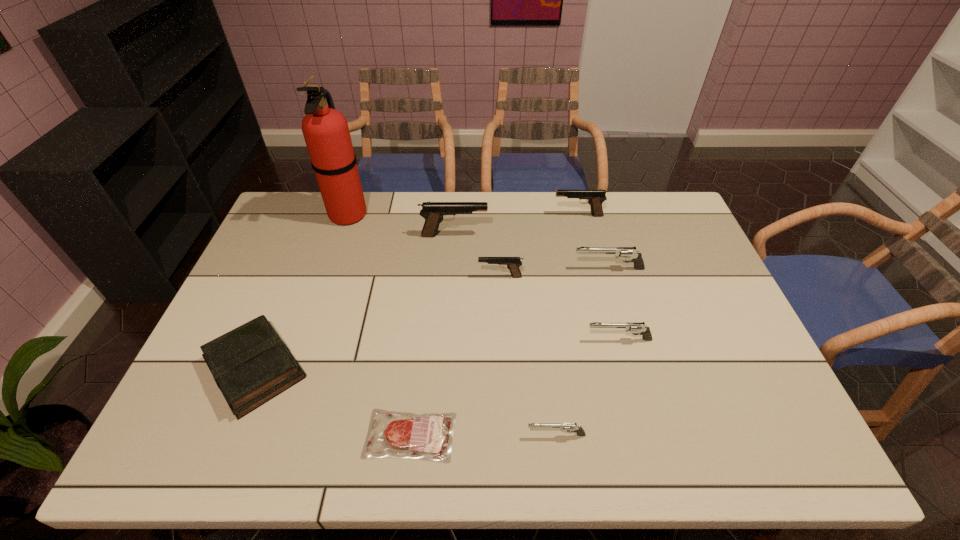
Find the location of a particular element. This screenshot has height=540, width=960. the second smallest silver pistol is located at coordinates (640, 327).

This screenshot has height=540, width=960. What are the coordinates of `the second nearest pistol` in the screenshot? It's located at (640, 327).

Identify the location of greenish book. This screenshot has width=960, height=540. coord(251,364).

This screenshot has width=960, height=540. Find the location of `the nearest silver pistol`. the nearest silver pistol is located at coordinates (569, 427).

Locate an element on the screen. The width and height of the screenshot is (960, 540). the nearest pistol is located at coordinates (569, 427).

Find the location of `steak`. steak is located at coordinates (426, 436).

This screenshot has height=540, width=960. I want to click on free space located at the nozzle of the fire extinguisher, so click(x=446, y=214).

Find the location of `vacant space located 0.080m at the muzzle of the second tallest object`. vacant space located 0.080m at the muzzle of the second tallest object is located at coordinates (511, 235).

Identify the location of free space located at the muzzle of the fifth shortest pistol. This screenshot has width=960, height=540. (519, 215).

Locate an element on the screen. vacant region located 0.310m at the muzzle of the fifth shortest pistol is located at coordinates (466, 215).